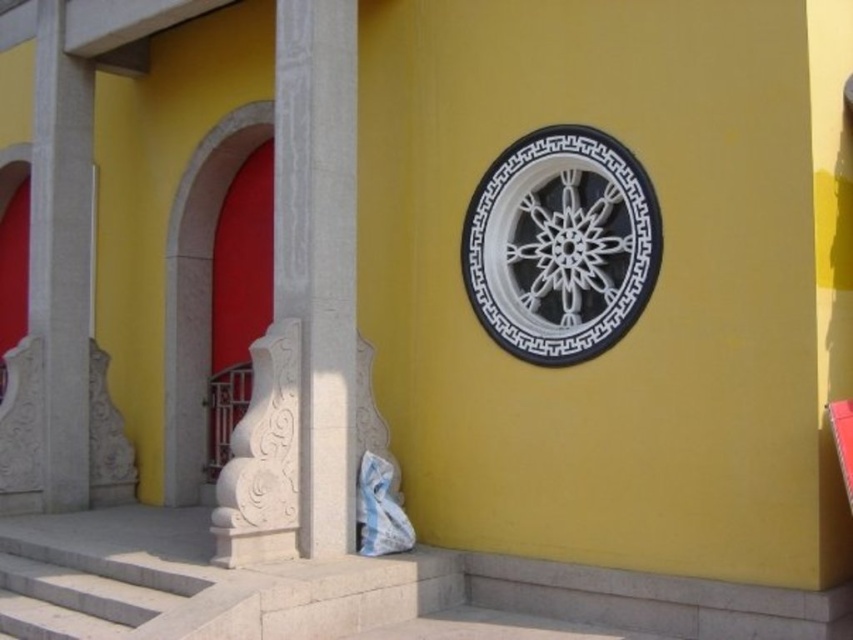
Question: Is white marble pillar at center thinner than white marble pillar at left?

Choices:
 (A) no
 (B) yes

Answer: (B)

Question: Considering the relative positions of white marble pillar at center and white marble pillar at left in the image provided, where is white marble pillar at center located with respect to white marble pillar at left?

Choices:
 (A) left
 (B) right

Answer: (B)

Question: Among these objects, which one is nearest to the camera?

Choices:
 (A) white marble pillar at left
 (B) white marble pillar at center

Answer: (B)

Question: Is white marble pillar at center further to the viewer compared to white marble pillar at left?

Choices:
 (A) no
 (B) yes

Answer: (A)

Question: Which point appears closest to the camera in this image?

Choices:
 (A) (315, 330)
 (B) (45, 144)

Answer: (A)

Question: Which point is farther to the camera?

Choices:
 (A) white marble pillar at left
 (B) white marble pillar at center

Answer: (A)